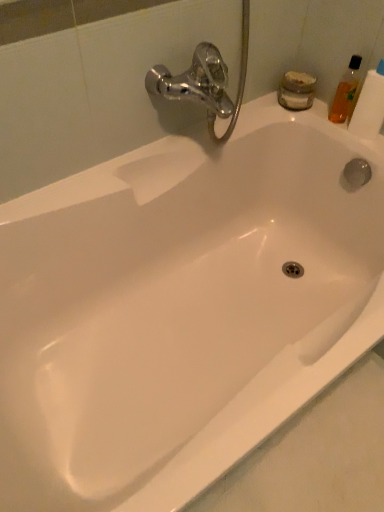
Question: From a real-world perspective, relative to translucent orange bottle at upper right, is translucent plastic toilet paper at upper right vertically above or below?

Choices:
 (A) above
 (B) below

Answer: (A)

Question: Is translucent plastic toilet paper at upper right wider or thinner than translucent orange bottle at upper right?

Choices:
 (A) thin
 (B) wide

Answer: (B)

Question: Is translucent plastic toilet paper at upper right to the left or to the right of translucent orange bottle at upper right in the image?

Choices:
 (A) left
 (B) right

Answer: (B)

Question: Considering their positions, is translucent orange bottle at upper right located in front of or behind translucent plastic toilet paper at upper right?

Choices:
 (A) front
 (B) behind

Answer: (B)

Question: Does point (347, 93) appear closer or farther from the camera than point (372, 74)?

Choices:
 (A) farther
 (B) closer

Answer: (A)

Question: Is translucent orange bottle at upper right to the left or to the right of translucent plastic toilet paper at upper right in the image?

Choices:
 (A) right
 (B) left

Answer: (B)

Question: From a real-world perspective, is translucent orange bottle at upper right above or below translucent plastic toilet paper at upper right?

Choices:
 (A) below
 (B) above

Answer: (A)